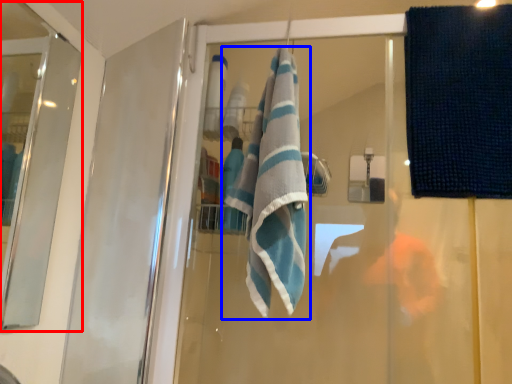
Question: Which object appears closest to the camera in this image, screen door (highlighted by a red box) or towel (highlighted by a blue box)?

Choices:
 (A) screen door
 (B) towel

Answer: (A)